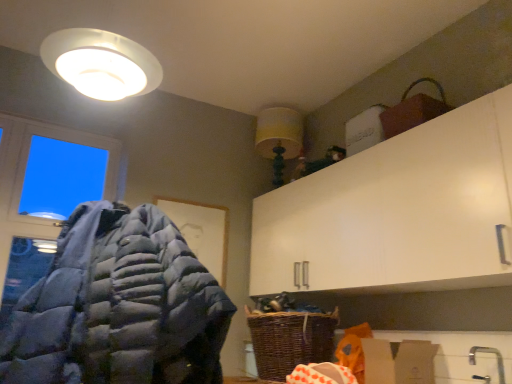
This screenshot has width=512, height=384. What are the coordinates of `free space above transparent glass window at upper left (from a real-world perspective)` in the screenshot? It's located at (40, 116).